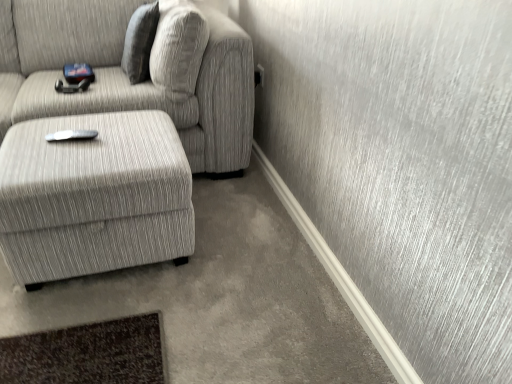
Question: Is textured gray fabric couch at left taller or shorter than textured gray pillow at upper center?

Choices:
 (A) tall
 (B) short

Answer: (A)

Question: Does point (x=192, y=91) appear closer or farther from the camera than point (x=138, y=11)?

Choices:
 (A) closer
 (B) farther

Answer: (A)

Question: Based on their relative distances, which object is farther from the textured gray fabric couch at left?

Choices:
 (A) textured gray pillow at upper center
 (B) textured gray ottoman at lower left

Answer: (B)

Question: Considering the real-world distances, which object is farthest from the textured gray fabric couch at left?

Choices:
 (A) textured gray ottoman at lower left
 (B) textured gray pillow at upper center

Answer: (A)